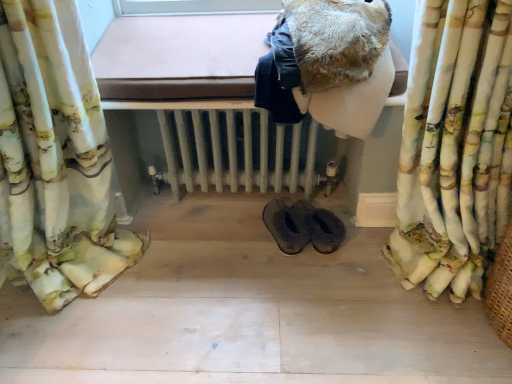
This screenshot has width=512, height=384. I want to click on free space in front of fluffy fabric curtain at right, so click(412, 340).